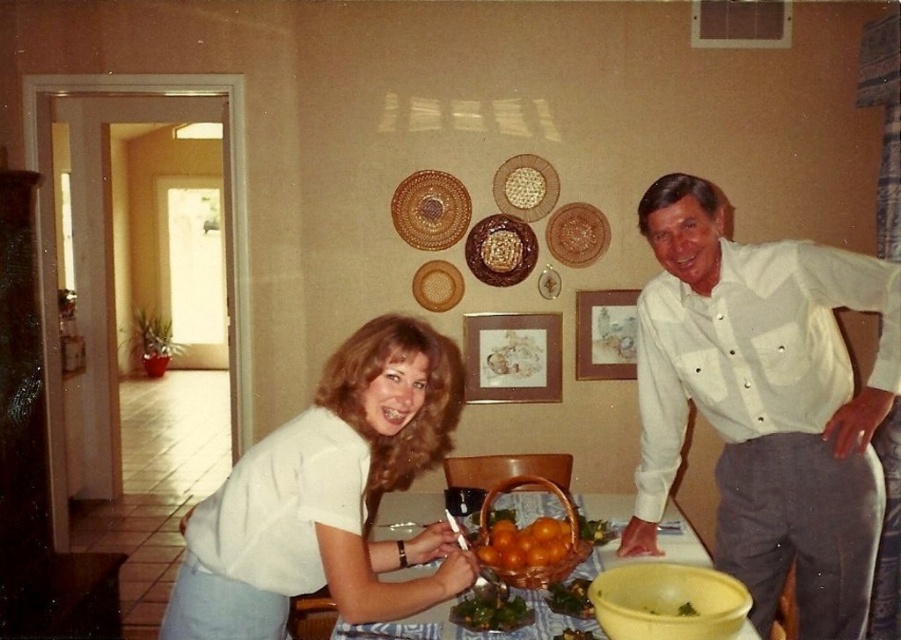
This screenshot has height=640, width=901. Describe the element at coordinates (430, 209) in the screenshot. I see `woven brown basket at upper center` at that location.

Is woven brown basket at upper center smaller than brown woven basket at center?

No, woven brown basket at upper center is not smaller than brown woven basket at center.

Describe the element at coordinates (430, 209) in the screenshot. I see `woven brown basket at upper center` at that location.

You are a GUI agent. You are given a task and a screenshot of the screen. Output one action in this format:
    pyautogui.click(x=<x>, y=<y>)
    Task: Click on the woven brown basket at upper center
    This screenshot has width=901, height=640.
    Given the screenshot: What is the action you would take?
    pyautogui.click(x=430, y=209)

Is woven brown basket at upper center shorter than matte brown woven basket at upper center?

No.

Is woven brown basket at upper center to the left of matte brown woven basket at upper center from the viewer's perspective?

Yes, woven brown basket at upper center is to the left of matte brown woven basket at upper center.

Is point (452, 236) more distant than point (580, 260)?

No, (452, 236) is closer to viewer.

The height and width of the screenshot is (640, 901). Find the location of `woven brown basket at upper center`. woven brown basket at upper center is located at coordinates (430, 209).

Is orange matte basket at center to the left of matte brown platter at center from the viewer's perspective?

In fact, orange matte basket at center is to the right of matte brown platter at center.

From the picture: Can you confirm if orange matte basket at center is bigger than matte brown platter at center?

Correct, orange matte basket at center is larger in size than matte brown platter at center.

Between point (542, 532) and point (444, 305), which one is positioned behind?

Positioned behind is point (444, 305).

Locate an element on the screen. This screenshot has width=901, height=640. orange matte basket at center is located at coordinates (x=525, y=544).